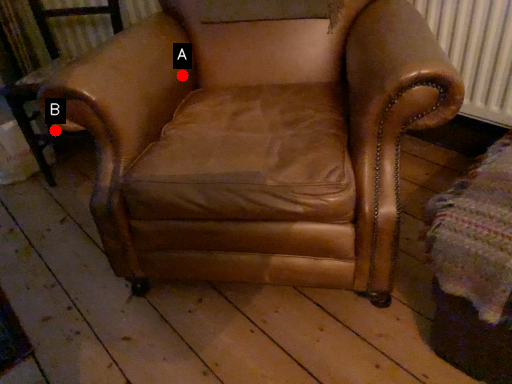
Question: Two points are circled on the image, labeled by A and B beside each circle. Among these points, which one is nearest to the camera?

Choices:
 (A) A is closer
 (B) B is closer

Answer: (A)